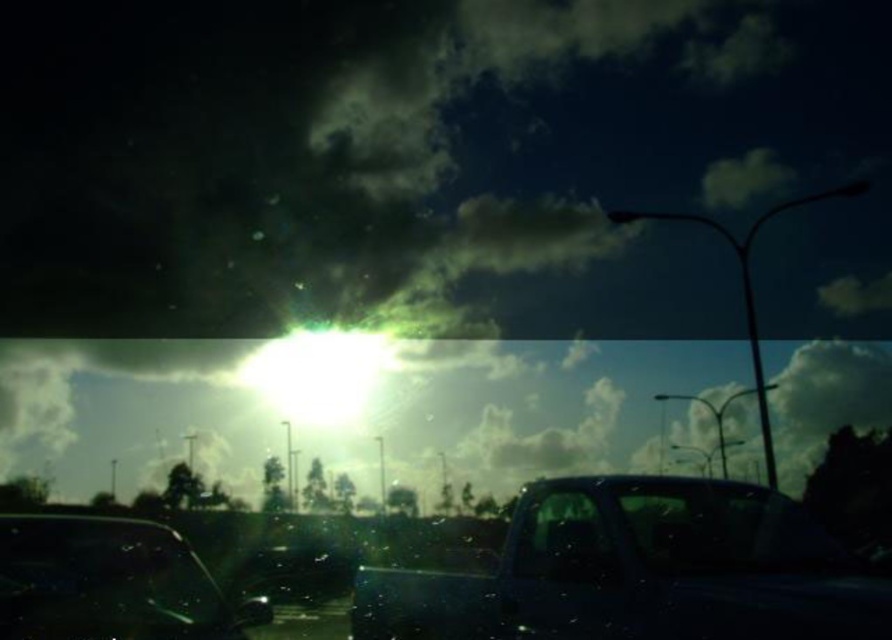
Between shiny black truck at center and transparent glass car at lower left, which one appears on the right side from the viewer's perspective?

shiny black truck at center is more to the right.

Between shiny black truck at center and transparent glass car at lower left, which one appears on the left side from the viewer's perspective?

transparent glass car at lower left

Between point (533, 488) and point (202, 584), which one is positioned behind?

The point (533, 488) is more distant.

Locate an element on the screen. This screenshot has height=640, width=892. shiny black truck at center is located at coordinates (639, 570).

This screenshot has width=892, height=640. Find the location of `shiny black truck at center`. shiny black truck at center is located at coordinates (639, 570).

Is shiny black truck at center shorter than transparent glass car window at center?

No.

Who is more forward, (647, 544) or (524, 560)?

Point (647, 544) is in front.

At what (x,y) coordinates should I click in order to perform the action: click on shiny black truck at center. Please return your answer as a coordinate pair (x, y). Looking at the image, I should click on (639, 570).

Is point (213, 580) in front of point (577, 531)?

No, (213, 580) is further to viewer.

Does transparent glass car at lower left come behind transparent glass car window at center?

That is False.

Image resolution: width=892 pixels, height=640 pixels. What are the coordinates of `transparent glass car at lower left` in the screenshot? It's located at (109, 582).

Locate an element on the screen. The image size is (892, 640). transparent glass car at lower left is located at coordinates (109, 582).